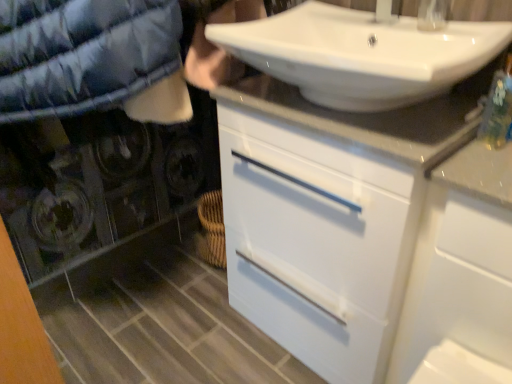
Image resolution: width=512 pixels, height=384 pixels. What do you see at coordinates (432, 14) in the screenshot?
I see `white glossy faucet at upper center` at bounding box center [432, 14].

What is the approximate height of white glossy faucet at upper center?

The height of white glossy faucet at upper center is 5.95 inches.

I want to click on white glossy cabinet at center, so point(366,229).

Does point (305, 290) lie behind point (326, 9)?

No, it is in front of (326, 9).

Considering the relative sizes of white glossy cabinet at center and white glossy sink at upper center in the image provided, is white glossy cabinet at center thinner than white glossy sink at upper center?

Correct, the width of white glossy cabinet at center is less than that of white glossy sink at upper center.

Who is shorter, white glossy cabinet at center or white glossy sink at upper center?

Standing shorter between the two is white glossy sink at upper center.

Where is `bathroom cabinet that appears below the white glossy sink at upper center (from the image's perspective)`? Image resolution: width=512 pixels, height=384 pixels. bathroom cabinet that appears below the white glossy sink at upper center (from the image's perspective) is located at coordinates (366, 229).

Is white glossy faucet at upper center spatially inside white glossy sink at upper center, or outside of it?

white glossy faucet at upper center is not enclosed by white glossy sink at upper center.

Which object is further away from the camera taking this photo, white glossy faucet at upper center or white glossy sink at upper center?

white glossy faucet at upper center is behind.

Is white glossy faucet at upper center oriented away from white glossy sink at upper center?

That's not correct — white glossy faucet at upper center is not looking away from white glossy sink at upper center.

Is white glossy cabinet at center not within white glossy faucet at upper center?

white glossy cabinet at center lies outside white glossy faucet at upper center's area.

Between point (296, 174) and point (433, 10), which one is positioned behind?

Point (433, 10)

What's the angular difference between white glossy cabinet at center and white glossy faucet at upper center's facing directions?

The angular difference between white glossy cabinet at center and white glossy faucet at upper center is 1.4 degrees.

The width and height of the screenshot is (512, 384). I want to click on sink above the white glossy cabinet at upper right (from a real-world perspective), so click(361, 54).

Are white glossy sink at upper center and white glossy cabinet at upper right making contact?

No, white glossy sink at upper center is not next to white glossy cabinet at upper right.

Considering the relative sizes of white glossy sink at upper center and white glossy cabinet at upper right in the image provided, is white glossy sink at upper center bigger than white glossy cabinet at upper right?

Actually, white glossy sink at upper center might be smaller than white glossy cabinet at upper right.

Is white glossy faucet at upper center next to white glossy cabinet at upper right?

No, white glossy faucet at upper center is not beside white glossy cabinet at upper right.

Measure the distance between white glossy faucet at upper center and white glossy cabinet at upper right.

The distance of white glossy faucet at upper center from white glossy cabinet at upper right is 25.44 inches.

Looking at this image, how different are the orientations of white glossy faucet at upper center and white glossy cabinet at upper right in degrees?

white glossy faucet at upper center and white glossy cabinet at upper right are facing 1.51 degrees away from each other.

From the picture: Is white glossy faucet at upper center not within white glossy cabinet at upper right?

Absolutely, white glossy faucet at upper center is external to white glossy cabinet at upper right.

From a real-world perspective, is white glossy cabinet at center physically below white glossy cabinet at upper right?

No, from a real-world perspective, white glossy cabinet at center is not beneath white glossy cabinet at upper right.

Is white glossy cabinet at center taller than white glossy cabinet at upper right?

Correct, white glossy cabinet at center is much taller as white glossy cabinet at upper right.

Is white glossy cabinet at center to the left of white glossy cabinet at upper right from the viewer's perspective?

Yes, white glossy cabinet at center is to the left of white glossy cabinet at upper right.

Would you say white glossy cabinet at center is a long distance from white glossy cabinet at upper right?

Actually, white glossy cabinet at center and white glossy cabinet at upper right are a little close together.

Is white glossy cabinet at upper right to the right of white glossy cabinet at center from the viewer's perspective?

Yes.

In the image, there is a white glossy cabinet at center. In order to click on cabinetry below it (from a real-world perspective) in this screenshot , I will do `click(457, 294)`.

Which of these two, white glossy cabinet at upper right or white glossy cabinet at center, is smaller?

white glossy cabinet at upper right is smaller.

Is white glossy cabinet at upper right next to white glossy cabinet at center and touching it?

No.

Where is `sink in front of the white glossy cabinet at center`? sink in front of the white glossy cabinet at center is located at coordinates (361, 54).

This screenshot has width=512, height=384. I want to click on faucet above the white glossy sink at upper center (from a real-world perspective), so pos(432,14).

Which object lies nearer to the anchor point white glossy cabinet at center, white glossy faucet at upper center or white glossy cabinet at upper right?

white glossy cabinet at upper right lies closer to white glossy cabinet at center than the other object.

From the picture: From the image, which object appears to be farther from white glossy sink at upper center, white glossy faucet at upper center or white glossy cabinet at upper right?

white glossy cabinet at upper right is positioned further to the anchor white glossy sink at upper center.

When comparing their distances from white glossy cabinet at upper right, does white glossy faucet at upper center or white glossy cabinet at center seem further?

white glossy faucet at upper center is further to white glossy cabinet at upper right.

When comparing their distances from white glossy cabinet at upper right, does white glossy cabinet at center or white glossy faucet at upper center seem closer?

white glossy cabinet at center lies closer to white glossy cabinet at upper right than the other object.

Estimate the real-world distances between objects in this image. Which object is closer to white glossy cabinet at upper right, white glossy cabinet at center or white glossy sink at upper center?

Among the two, white glossy cabinet at center is located nearer to white glossy cabinet at upper right.

Estimate the real-world distances between objects in this image. Which object is further from white glossy cabinet at center, white glossy sink at upper center or white glossy cabinet at upper right?

white glossy sink at upper center.

Considering their positions, is white glossy cabinet at center positioned closer to white glossy sink at upper center than white glossy cabinet at upper right?

white glossy cabinet at center.

Estimate the real-world distances between objects in this image. Which object is closer to white glossy cabinet at center, white glossy cabinet at upper right or white glossy faucet at upper center?

The object closer to white glossy cabinet at center is white glossy cabinet at upper right.

You are a GUI agent. You are given a task and a screenshot of the screen. Output one action in this format:
    pyautogui.click(x=<x>, y=<y>)
    Task: Click on the bathroom cabinet that lies between white glossy sink at upper center and white glossy cabinet at upper right from top to bottom
    Image resolution: width=512 pixels, height=384 pixels.
    Given the screenshot: What is the action you would take?
    pyautogui.click(x=366, y=229)

In order to click on sink that lies between white glossy faucet at upper center and white glossy cabinet at upper right from top to bottom in this screenshot , I will do (x=361, y=54).

This screenshot has width=512, height=384. In order to click on bathroom cabinet between white glossy faucet at upper center and white glossy cabinet at upper right in the vertical direction in this screenshot , I will do `click(366, 229)`.

Locate an element on the screen. This screenshot has height=384, width=512. sink that lies between white glossy faucet at upper center and white glossy cabinet at center from top to bottom is located at coordinates (361, 54).